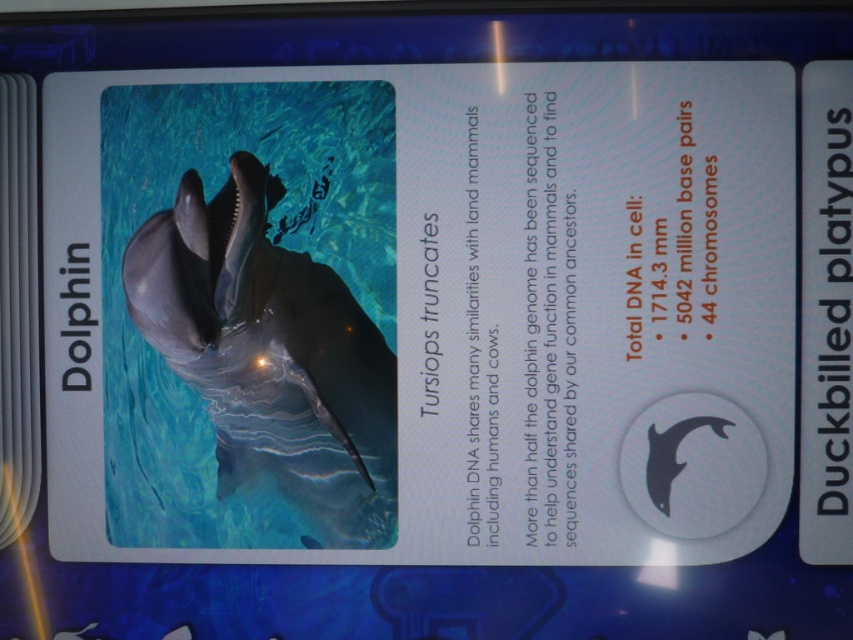
Who is lower down, shiny gray dolphin at center or black matte dolphin at lower right?

black matte dolphin at lower right

Between shiny gray dolphin at center and black matte dolphin at lower right, which one is positioned higher?

shiny gray dolphin at center

Identify the location of shiny gray dolphin at center. Image resolution: width=853 pixels, height=640 pixels. (271, 356).